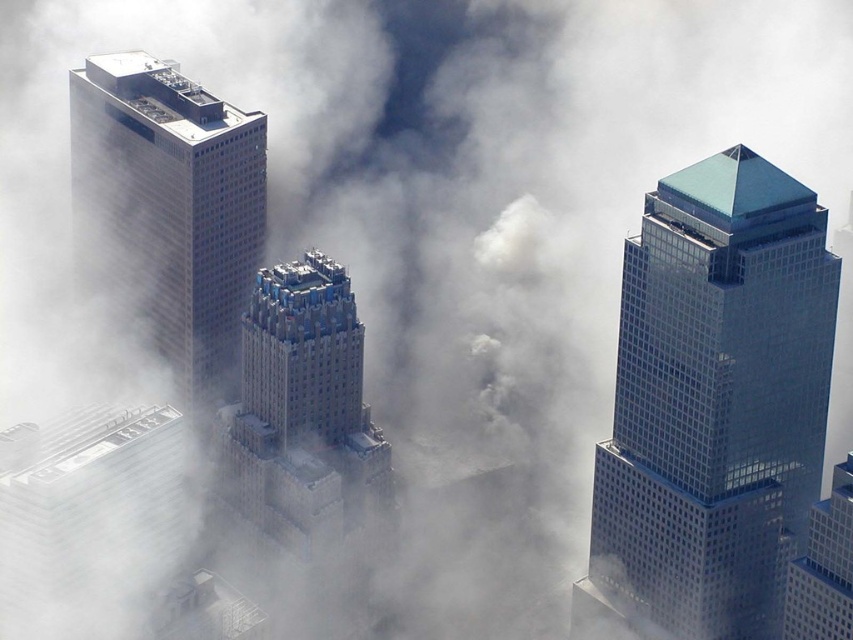
You are a city planner analyzing the cityscape. You need to determine which skyscraper occupies more horizontal space. Based on the aerial view provided, which skyscraper is wider between the glassy blue skyscraper at center and the matte glass skyscraper at left?

The glassy blue skyscraper at center is wider than the matte glass skyscraper at left according to the description provided.

Based on the scene described, which object occupies more space in the image between the gray concrete skyscraper at center and the white fluffy cloud at center?

The gray concrete skyscraper at center has a larger size compared to the white fluffy cloud at center, so it occupies more space in the image.

Based on the scene description, can you determine which object is taller between the gray concrete skyscraper at center and the white fluffy cloud at center?

The gray concrete skyscraper at center is taller than the white fluffy cloud at center according to the description.